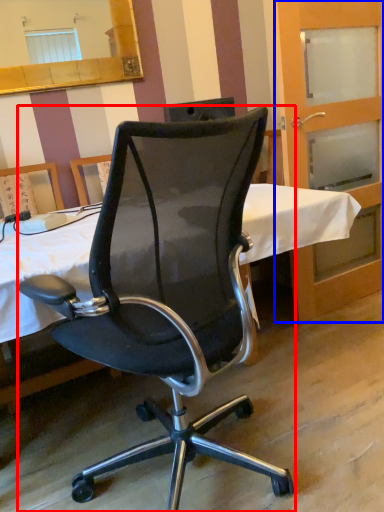
Question: Which point is closer to the camera, chair (highlighted by a red box) or screen door (highlighted by a blue box)?

Choices:
 (A) chair
 (B) screen door

Answer: (A)